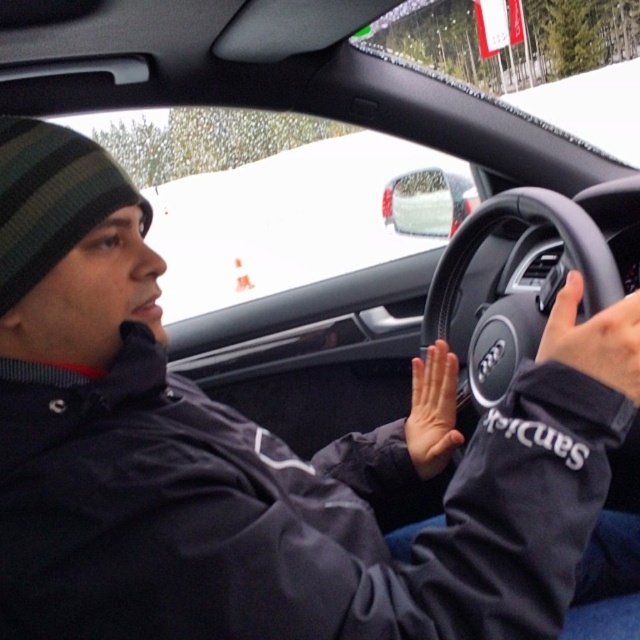
Question: Which point is closer to the camera taking this photo?

Choices:
 (A) (630, 321)
 (B) (452, 397)
 (C) (17, 145)

Answer: (C)

Question: Which point is closer to the camera?

Choices:
 (A) black matte hand at steering wheel
 (B) green striped knit hat at upper left
 (C) smooth skin hand at center

Answer: (B)

Question: In this image, where is black leather steering wheel at center located relative to smooth skin hand at center?

Choices:
 (A) above
 (B) below

Answer: (A)

Question: Among these points, which one is farthest from the camera?

Choices:
 (A) (465, 269)
 (B) (99, 195)
 (C) (420, 385)
 (D) (556, 346)

Answer: (A)

Question: Can you confirm if black leather steering wheel at center is bigger than black matte hand at steering wheel?

Choices:
 (A) yes
 (B) no

Answer: (A)

Question: Can you confirm if black leather steering wheel at center is positioned above green striped knit hat at upper left?

Choices:
 (A) yes
 (B) no

Answer: (B)